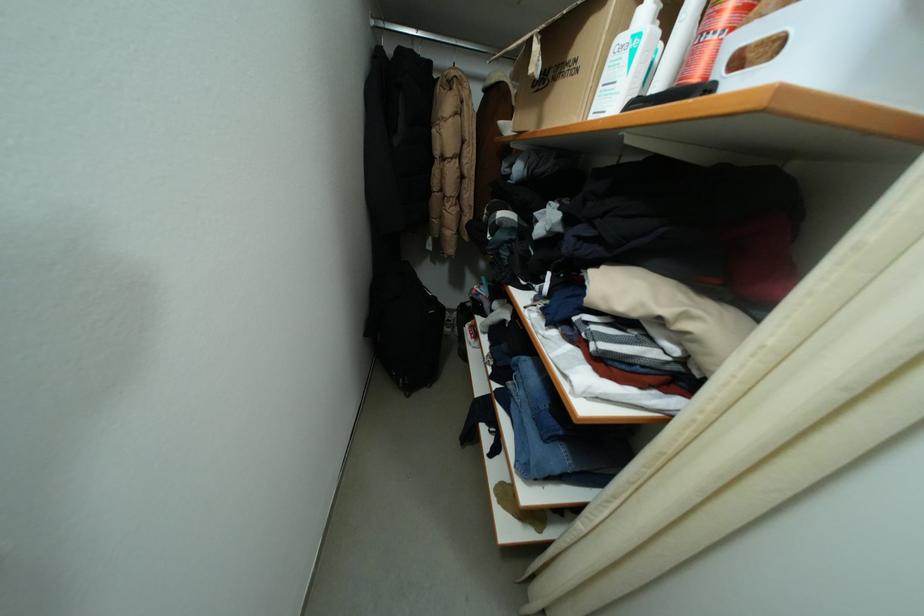
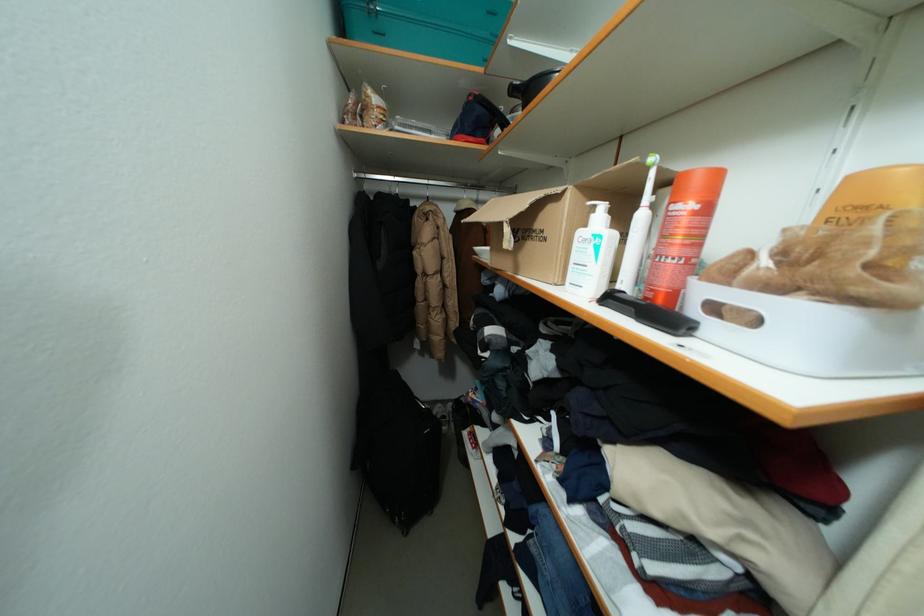
Locate, in the second image, the point that corresponds to [723,36] in the first image.

(681, 262)